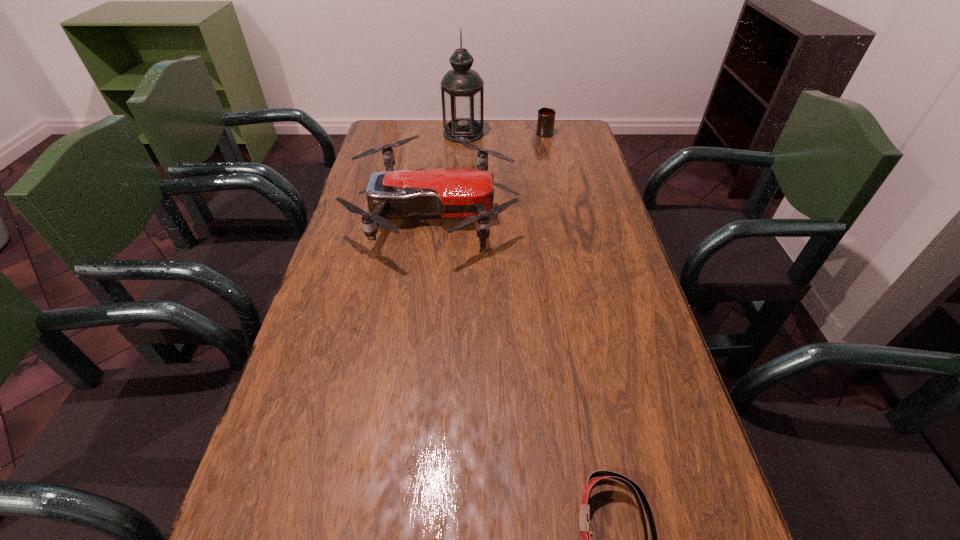
Where is `object positioned at the far right corner`? The image size is (960, 540). object positioned at the far right corner is located at coordinates (546, 116).

You are a GUI agent. You are given a task and a screenshot of the screen. Output one action in this format:
    pyautogui.click(x=<x>, y=<y>)
    Task: Click on the vacant space at the far edge of the desktop
    This screenshot has height=540, width=960.
    Given the screenshot: What is the action you would take?
    pyautogui.click(x=517, y=148)

What are the coordinates of `free space at the left edge` in the screenshot? It's located at (348, 291).

This screenshot has width=960, height=540. In order to click on free space at the right edge of the desktop in this screenshot , I will do `click(594, 194)`.

Identify which object is the second closest to the second shortest object. Please provide its 2D coordinates. Your answer should be formatted as a tuple, i.e. [(x, y)], where the tuple contains the x and y coordinates of a point satisfying the conditions above.

[(465, 193)]

Select which object is the third closest to the shortest object. Please provide its 2D coordinates. Your answer should be formatted as a tuple, i.e. [(x, y)], where the tuple contains the x and y coordinates of a point satisfying the conditions above.

[(546, 116)]

Where is `vacant position in the image that satisfies the following two spatial constraints: 1. on the front side of the can; 2. on the front-facing side of the drone`? The image size is (960, 540). vacant position in the image that satisfies the following two spatial constraints: 1. on the front side of the can; 2. on the front-facing side of the drone is located at coordinates (562, 213).